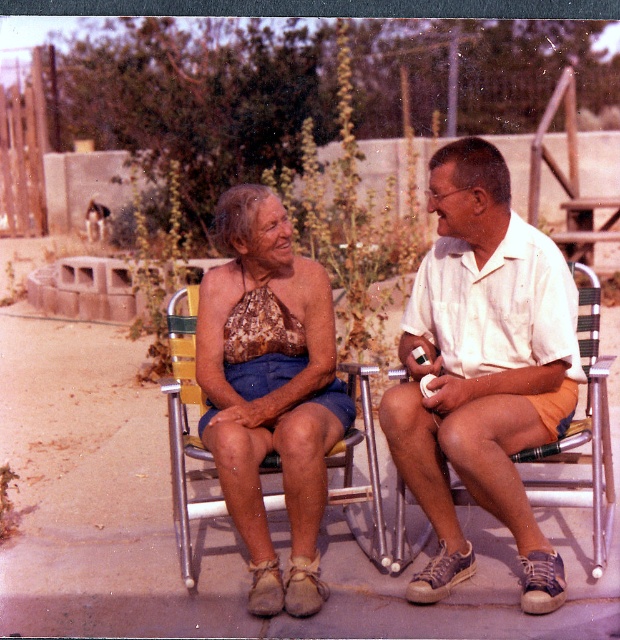
Question: Which point is farther to the camera?

Choices:
 (A) brown sequined top at center
 (B) matte brown halter top at center

Answer: (A)

Question: Is matte brown halter top at center bigger than metallic silver beach chair at center?

Choices:
 (A) yes
 (B) no

Answer: (A)

Question: Is matte brown halter top at center in front of metallic silver beach chair at center?

Choices:
 (A) no
 (B) yes

Answer: (B)

Question: Estimate the real-world distances between objects in this image. Which object is closer to the matte brown halter top at center?

Choices:
 (A) metallic silver beach chair at center
 (B) brown sequined top at center

Answer: (A)

Question: Based on their relative distances, which object is nearer to the brown sequined top at center?

Choices:
 (A) matte brown halter top at center
 (B) metallic silver beach chair at center

Answer: (A)

Question: Does brown sequined top at center appear on the right side of metallic silver beach chair at center?

Choices:
 (A) yes
 (B) no

Answer: (B)